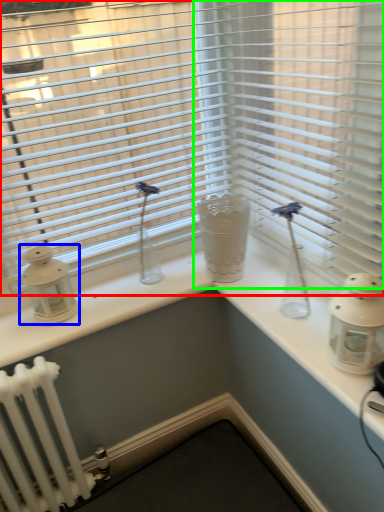
Question: Which object is positioned farthest from window blind (highlighted by a red box)? Select from candle holder (highlighted by a blue box) and blind (highlighted by a green box).

Choices:
 (A) candle holder
 (B) blind

Answer: (A)